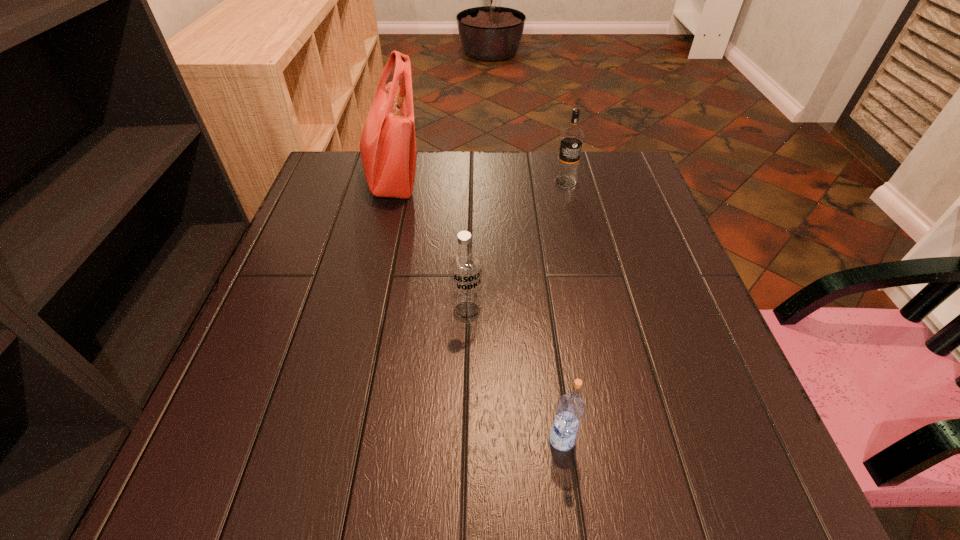
Where is `vacant space that is in between the rightmost object and the leftmost vodka`? Image resolution: width=960 pixels, height=540 pixels. vacant space that is in between the rightmost object and the leftmost vodka is located at coordinates (516, 247).

Locate an element on the screen. unoccupied area between the second nearest vodka and the tallest object is located at coordinates (429, 246).

Locate an element on the screen. free area in between the handbag and the leftmost vodka is located at coordinates (429, 246).

Find the location of a particular element. free space that is in between the nearest object and the rightmost object is located at coordinates (564, 310).

Identify the location of the closest object to the second vodka from left to right. The width and height of the screenshot is (960, 540). (465, 264).

At what (x,y) coordinates should I click in order to perform the action: click on the closest object to the rightmost object. Please return your answer as a coordinate pair (x, y). Looking at the image, I should click on (388, 145).

Choose which vodka is the second nearest neighbor to the leftmost vodka. Please provide its 2D coordinates. Your answer should be formatted as a tuple, i.e. [(x, y)], where the tuple contains the x and y coordinates of a point satisfying the conditions above.

[(571, 141)]

The width and height of the screenshot is (960, 540). Identify the location of the second closest vodka to the second object from right to left. pos(571,141).

What are the coordinates of `free space that satisfies the following two spatial constraints: 1. on the back side of the shortest object; 2. on the front-facing side of the tallest object` in the screenshot? It's located at (527, 179).

The height and width of the screenshot is (540, 960). In order to click on vacant position in the image that satisfies the following two spatial constraints: 1. on the front label of the leftmost vodka; 2. on the left side of the second vodka from left to right in this screenshot , I will do [x=464, y=439].